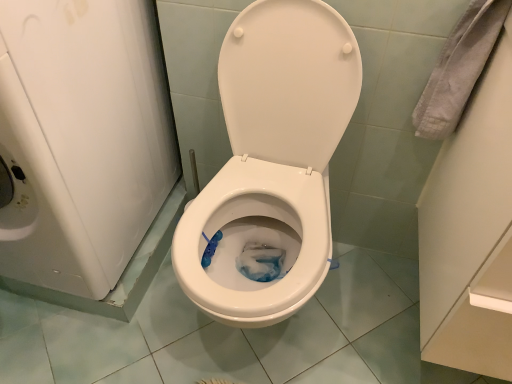
Question: From a real-world perspective, relative to white glossy washing machine at left, is white glossy toilet at center vertically above or below?

Choices:
 (A) above
 (B) below

Answer: (B)

Question: Is white glossy toilet at center to the left or to the right of white glossy washing machine at left in the image?

Choices:
 (A) right
 (B) left

Answer: (A)

Question: Is white glossy toilet at center inside or outside of white glossy washing machine at left?

Choices:
 (A) outside
 (B) inside

Answer: (A)

Question: In terms of height, does white glossy washing machine at left look taller or shorter compared to white glossy toilet at center?

Choices:
 (A) tall
 (B) short

Answer: (A)

Question: Visually, is white glossy washing machine at left positioned to the left or to the right of white glossy toilet at center?

Choices:
 (A) right
 (B) left

Answer: (B)

Question: Is white glossy washing machine at left inside the boundaries of white glossy toilet at center, or outside?

Choices:
 (A) outside
 (B) inside

Answer: (A)

Question: In terms of size, does white glossy washing machine at left appear bigger or smaller than white glossy toilet at center?

Choices:
 (A) small
 (B) big

Answer: (B)